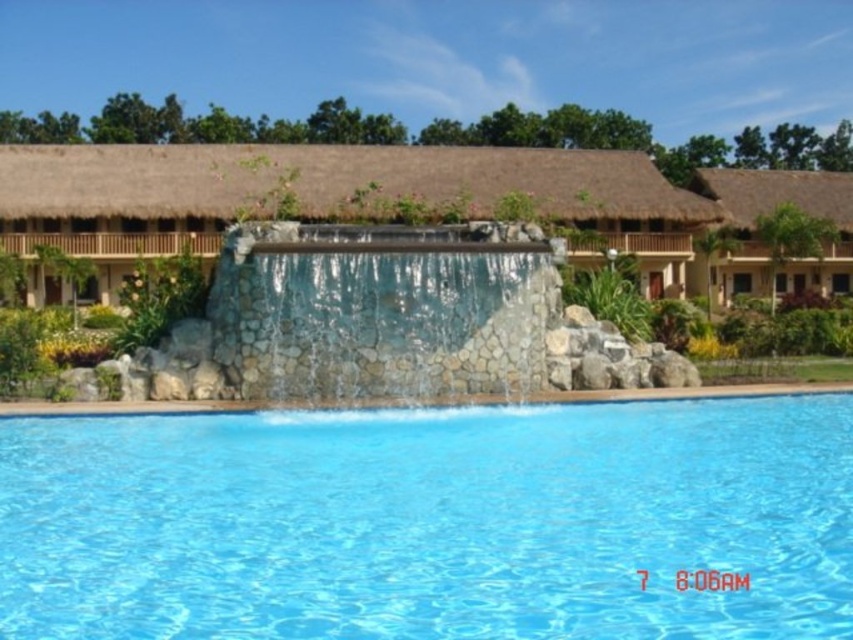
You are standing at the edge of the swimming pool and want to take a photo of the brown thatch hut at center and the translucent stone waterfall at center. Which object should you position closer to the camera to ensure both are in focus?

You should position the brown thath hut at center closer to the camera because the translucent stone waterfall at center is behind it, so focusing on the closer object will keep both in focus.

You are a photographer planning to capture the clear blue water at center and the thatched roof hut at upper right in a single shot. Based on their sizes in the image, which object should you focus on first to ensure both are in frame?

The clear blue water at center occupies less space than the thatched roof hut at upper right, so you should focus on the thatched roof hut at upper right first to ensure both are in frame.